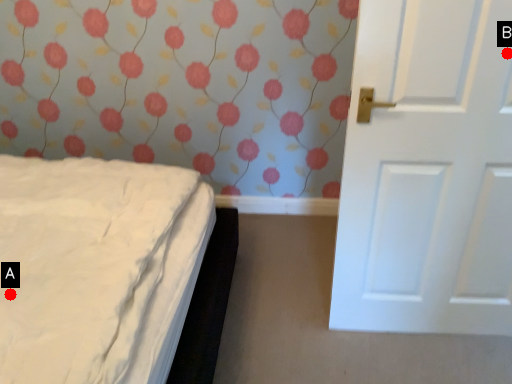
Question: Two points are circled on the image, labeled by A and B beside each circle. Which point is farther to the camera?

Choices:
 (A) A is further
 (B) B is further

Answer: (B)